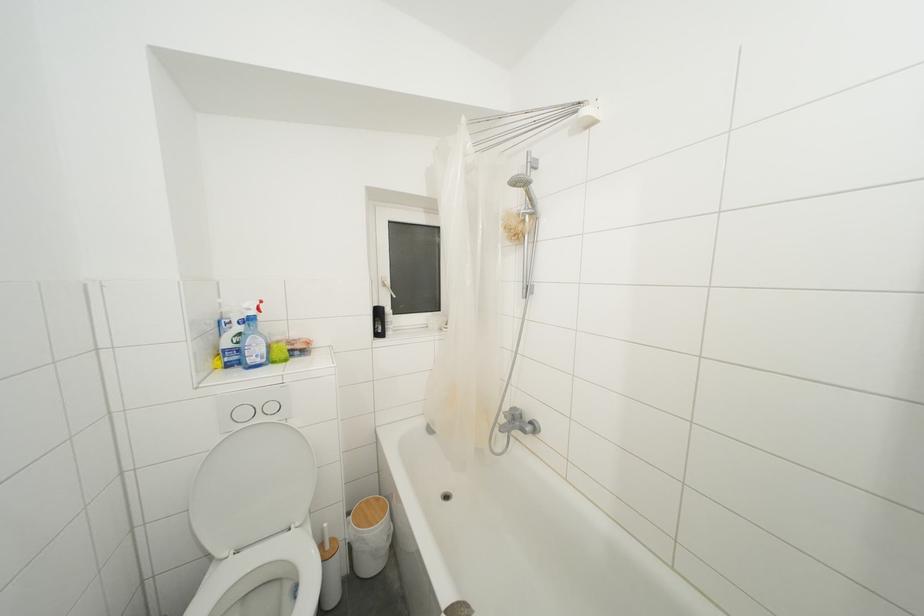
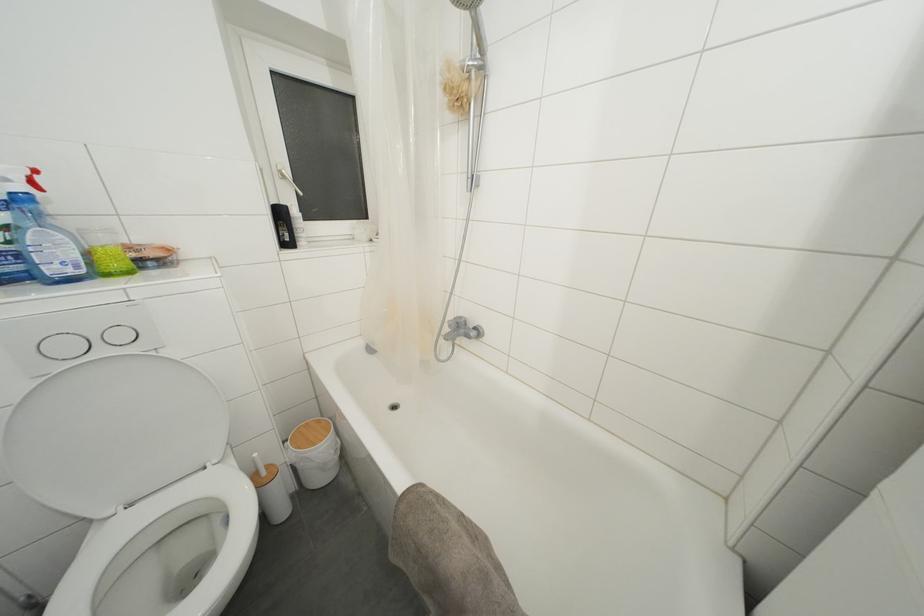
Locate, in the second image, the point that corresponds to point 330,530 in the first image.

(260, 459)